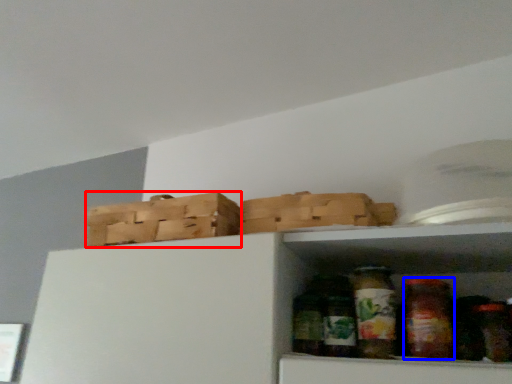
Question: Which object is closer to the camera taking this photo, basket (highlighted by a red box) or glass jar (highlighted by a blue box)?

Choices:
 (A) basket
 (B) glass jar

Answer: (B)